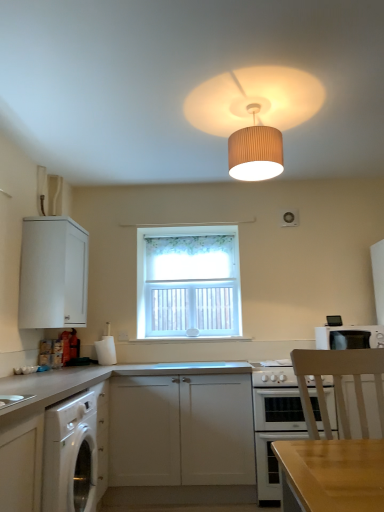
What do you see at coordinates (273, 374) in the screenshot?
I see `white glossy gas stove at lower center` at bounding box center [273, 374].

The width and height of the screenshot is (384, 512). Find the location of `white glossy gas stove at lower center`. white glossy gas stove at lower center is located at coordinates (273, 374).

Image resolution: width=384 pixels, height=512 pixels. What do you see at coordinates (188, 281) in the screenshot? I see `white floral curtain at center` at bounding box center [188, 281].

From the picture: In order to face white glossy oven at lower center, should I rotate leftwards or rightwards?

You should look right and rotate roughly 12.333 degrees.

What do you see at coordinates (190, 258) in the screenshot?
I see `floral fabric curtain at center` at bounding box center [190, 258].

The image size is (384, 512). I want to click on beige pleated lampshade at upper center, so click(x=255, y=151).

Describe the element at coordinates (54, 454) in the screenshot. I see `white matte cabinet at lower left, positioned as the 3th cabinetry in back-to-front order` at that location.

Locate an element on the screen. The width and height of the screenshot is (384, 512). white glossy microwave at upper right is located at coordinates (349, 337).

Locate an element on the screen. This screenshot has height=512, width=384. white glossy gas stove at lower center is located at coordinates point(273,374).

Locate an element on the screen. The height and width of the screenshot is (512, 384). exhaust hood above the white matte cabinet at left, placed as the first cabinetry when sorted from back to front (from a real-world perspective) is located at coordinates (188, 224).

Which of these two, white matte cabinet at left, placed as the first cabinetry when sorted from back to front, or white glossy exhaust hood at upper center, is thinner?

Thinner between the two is white glossy exhaust hood at upper center.

From the image's perspective, who appears lower, white matte cabinet at left, marked as the 3th cabinetry in a front-to-back arrangement, or white glossy exhaust hood at upper center?

white matte cabinet at left, marked as the 3th cabinetry in a front-to-back arrangement, appears lower in the image.

Can you tell me how much white matte cabinet at lower center, which ranks as the 2th cabinetry in front-to-back order, and white glossy microwave at upper right differ in facing direction?

2.46 degrees.

This screenshot has width=384, height=512. There is a white glossy microwave at upper right. Find the location of `the 2nd cabinetry below it (from the image's perspective)`. the 2nd cabinetry below it (from the image's perspective) is located at coordinates 125,431.

How far apart are white matte cabinet at lower center, which ranks as the 2th cabinetry in front-to-back order, and white glossy microwave at upper right?

white matte cabinet at lower center, which ranks as the 2th cabinetry in front-to-back order, and white glossy microwave at upper right are 3.42 feet apart from each other.

Does white matte cabinet at lower center, the 2th cabinetry viewed from the back, touch white glossy microwave at upper right?

No, white matte cabinet at lower center, the 2th cabinetry viewed from the back, is not making contact with white glossy microwave at upper right.

Does beige pleated lampshade at upper center turn towards white glossy gas stove at lower center?

No, beige pleated lampshade at upper center is not oriented towards white glossy gas stove at lower center.

Considering the relative sizes of beige pleated lampshade at upper center and white glossy gas stove at lower center in the image provided, is beige pleated lampshade at upper center smaller than white glossy gas stove at lower center?

Yes.

Considering the positions of objects beige pleated lampshade at upper center and white glossy gas stove at lower center in the image provided, who is more to the left, beige pleated lampshade at upper center or white glossy gas stove at lower center?

From the viewer's perspective, beige pleated lampshade at upper center appears more on the left side.

Who is taller, beige pleated lampshade at upper center or white glossy gas stove at lower center?

beige pleated lampshade at upper center.

In terms of size, does white matte cabinet at lower left, which appears as the 1th cabinetry when viewed from the front, appear bigger or smaller than light wood chair at lower right?

white matte cabinet at lower left, which appears as the 1th cabinetry when viewed from the front, is bigger than light wood chair at lower right.

Consider the image. From a real-world perspective, is white matte cabinet at lower left, positioned as the 3th cabinetry in back-to-front order, positioned above or below light wood chair at lower right?

From a real-world perspective, white matte cabinet at lower left, positioned as the 3th cabinetry in back-to-front order, is physically below light wood chair at lower right.

Is white matte cabinet at lower left, which appears as the 1th cabinetry when viewed from the front, thinner than light wood chair at lower right?

Indeed, white matte cabinet at lower left, which appears as the 1th cabinetry when viewed from the front, has a lesser width compared to light wood chair at lower right.

Considering the positions of objects white matte cabinet at lower left, which appears as the 1th cabinetry when viewed from the front, and light wood chair at lower right in the image provided, who is in front, white matte cabinet at lower left, which appears as the 1th cabinetry when viewed from the front, or light wood chair at lower right?

light wood chair at lower right is in front.

From the image's perspective, which one is positioned lower, beige pleated lampshade at upper center or floral fabric curtain at center?

floral fabric curtain at center is shown below in the image.

Can you confirm if beige pleated lampshade at upper center is smaller than floral fabric curtain at center?

Correct, beige pleated lampshade at upper center occupies less space than floral fabric curtain at center.

From a real-world perspective, which is physically below, beige pleated lampshade at upper center or floral fabric curtain at center?

floral fabric curtain at center, from a real-world perspective.

In the scene shown: Does beige pleated lampshade at upper center turn towards floral fabric curtain at center?

No, beige pleated lampshade at upper center is not facing towards floral fabric curtain at center.

Which is less distant, (208, 251) or (264, 176)?

Point (264, 176)

Which is in front, white floral curtain at center or beige pleated lampshade at upper center?

Positioned in front is beige pleated lampshade at upper center.

Who is taller, white floral curtain at center or beige pleated lampshade at upper center?

white floral curtain at center.

Is white floral curtain at center located outside beige pleated lampshade at upper center?

Yes, white floral curtain at center is not within beige pleated lampshade at upper center.

Is point (358, 330) closer to viewer compared to point (250, 177)?

No.

Consider the image. Are white glossy microwave at upper right and beige pleated lampshade at upper center far apart?

white glossy microwave at upper right is positioned a significant distance from beige pleated lampshade at upper center.

This screenshot has width=384, height=512. I want to click on kitchen appliance on the right of beige pleated lampshade at upper center, so click(349, 337).

Is white glossy microwave at upper right wider or thinner than beige pleated lampshade at upper center?

white glossy microwave at upper right is thinner than beige pleated lampshade at upper center.

Where is `exhaust hood above the white matte cabinet at left, marked as the 3th cabinetry in a front-to-back arrangement (from the image's perspective)`? exhaust hood above the white matte cabinet at left, marked as the 3th cabinetry in a front-to-back arrangement (from the image's perspective) is located at coordinates (188, 224).

There is a white matte cabinet at lower center, the 2th cabinetry viewed from the back. What are the coordinates of `kitchen appliance above it (from a real-world perspective)` in the screenshot? It's located at (349, 337).

Which object lies nearer to the anchor point white glossy microwave at upper right, light wood chair at lower right or white glossy gas stove at lower center?

white glossy gas stove at lower center is closer to white glossy microwave at upper right.

Which object lies further to the anchor point white matte cabinet at lower left, which appears as the 1th cabinetry when viewed from the front, floral fabric curtain at center or white glossy exhaust hood at upper center?

white glossy exhaust hood at upper center lies further to white matte cabinet at lower left, which appears as the 1th cabinetry when viewed from the front, than the other object.

When comparing their distances from white glossy oven at lower center, does light wood chair at lower right or white glossy exhaust hood at upper center seem closer?

light wood chair at lower right.

Looking at the image, which one is located further to white floral curtain at center, white glossy gas stove at lower center or white glossy microwave at upper right?

white glossy microwave at upper right lies further to white floral curtain at center than the other object.

From the image, which object appears to be nearer to white matte cabinet at lower center, the 2th cabinetry viewed from the back, white glossy gas stove at lower center or light wood chair at lower right?

The object closer to white matte cabinet at lower center, the 2th cabinetry viewed from the back, is white glossy gas stove at lower center.

Which object lies further to the anchor point white glossy microwave at upper right, white matte cabinet at lower left, positioned as the 3th cabinetry in back-to-front order, or white matte cabinet at lower center, which ranks as the 2th cabinetry in front-to-back order?

The object further to white glossy microwave at upper right is white matte cabinet at lower left, positioned as the 3th cabinetry in back-to-front order.

From the image, which object appears to be nearer to white matte cabinet at left, marked as the 3th cabinetry in a front-to-back arrangement, light wood chair at lower right or white floral curtain at center?

white floral curtain at center is positioned closer to the anchor white matte cabinet at left, marked as the 3th cabinetry in a front-to-back arrangement.

From the image, which object appears to be farther from white glossy microwave at upper right, white floral curtain at center or floral fabric curtain at center?

Among the two, floral fabric curtain at center is located further to white glossy microwave at upper right.

Where is `oven located between light wood chair at lower right and white glossy gas stove at lower center in the depth direction`? Image resolution: width=384 pixels, height=512 pixels. oven located between light wood chair at lower right and white glossy gas stove at lower center in the depth direction is located at coordinates (274, 423).

Where is `window screen between white matte cabinet at left, marked as the 3th cabinetry in a front-to-back arrangement, and white glossy gas stove at lower center`? window screen between white matte cabinet at left, marked as the 3th cabinetry in a front-to-back arrangement, and white glossy gas stove at lower center is located at coordinates (190, 258).

At what (x,y) coordinates should I click in order to perform the action: click on window screen that lies between beige pleated lampshade at upper center and white glossy oven at lower center from top to bottom. Please return your answer as a coordinate pair (x, y). Image resolution: width=384 pixels, height=512 pixels. Looking at the image, I should click on (190, 258).

Where is `window screen between white glossy exhaust hood at upper center and white matte cabinet at lower center, which ranks as the 2th cabinetry in front-to-back order, from top to bottom`? Image resolution: width=384 pixels, height=512 pixels. window screen between white glossy exhaust hood at upper center and white matte cabinet at lower center, which ranks as the 2th cabinetry in front-to-back order, from top to bottom is located at coordinates (190, 258).